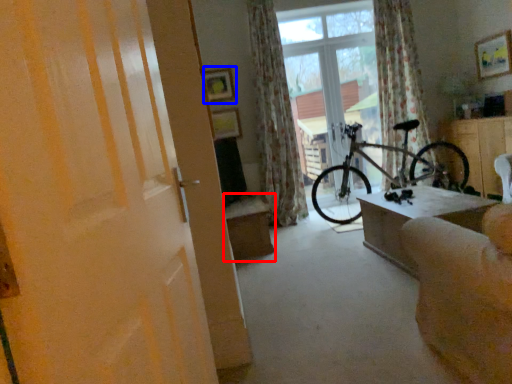
Question: Which object appears closest to the camera in this image, table (highlighted by a red box) or picture frame (highlighted by a blue box)?

Choices:
 (A) table
 (B) picture frame

Answer: (A)